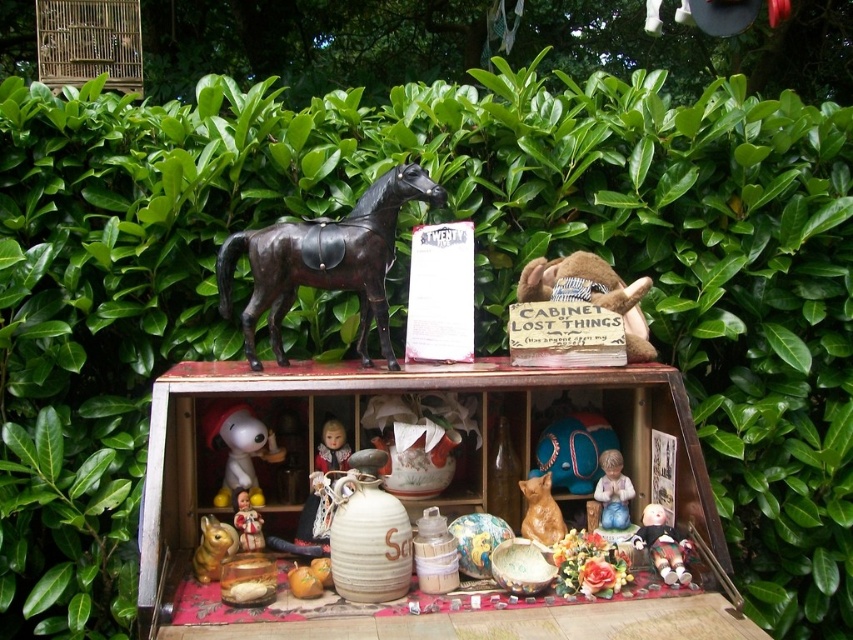
Question: Is the position of matte yellow snoopy at lower left more distant than that of matte plastic baby doll at center?

Choices:
 (A) yes
 (B) no

Answer: (A)

Question: Which object appears closest to the camera in this image?

Choices:
 (A) smooth wooden doll at center
 (B) brown plush monkey at center
 (C) matte yellow snoopy at lower left

Answer: (C)

Question: Which point is farther from the camera taking this photo?

Choices:
 (A) (312, 284)
 (B) (622, 500)
 (C) (317, 452)
 (D) (251, 524)

Answer: (C)

Question: Is brown plush monkey at center positioned in front of porcelain praying figure at center?

Choices:
 (A) no
 (B) yes

Answer: (A)

Question: Is porcelain praying figure at center closer to the viewer compared to smooth wooden doll at center?

Choices:
 (A) no
 (B) yes

Answer: (B)

Question: Which object appears closest to the camera in this image?

Choices:
 (A) shiny black horse at center
 (B) matte yellow snoopy at lower left
 (C) matte plastic baby doll at center

Answer: (C)